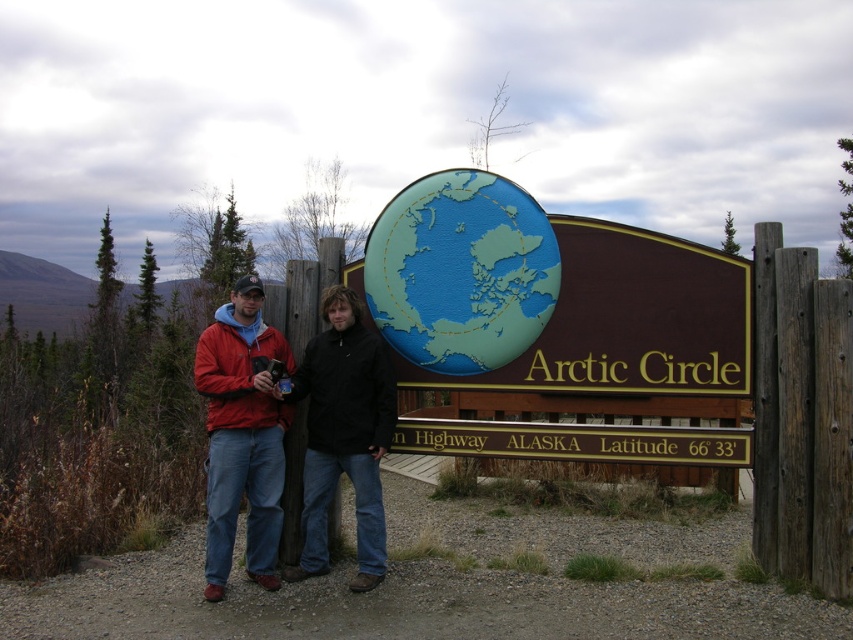
You are a photographer planning to take a picture of the matte blue globe at center and the matte black jacket at center. Based on their heights, which object should you focus on first if you want to ensure both are in frame without adjusting your camera settings?

The matte blue globe at center is not as tall as the matte black jacket at center, so you should focus on the taller matte black jacket at center first to ensure both are in frame.

You are a tourist standing in front of the Arctic Circle sign in Alaska. You notice the brown wooden sign at center and the matte blue globe at center. Which object is positioned higher up on the sign?

The matte blue globe at center is positioned higher up on the sign because the brown wooden sign at center is located below it.